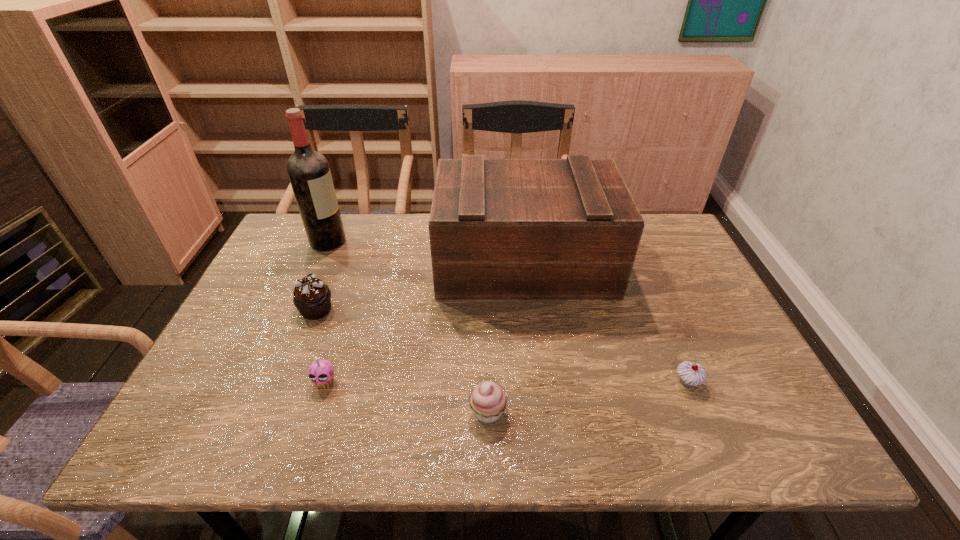
This screenshot has height=540, width=960. In order to click on vacant space located 0.270m on the left of the second cupcake from right to left in this screenshot , I will do `click(339, 412)`.

Find the location of a particular element. Image resolution: width=960 pixels, height=540 pixels. blank area located on the face of the third object from left to right is located at coordinates (308, 435).

At what (x,y) coordinates should I click in order to perform the action: click on liquor that is at the far edge. Please return your answer as a coordinate pair (x, y). Looking at the image, I should click on (308, 170).

I want to click on box at the far edge, so coord(500,229).

Where is `object that is at the near edge`? The image size is (960, 540). object that is at the near edge is located at coordinates (488, 401).

Find the location of a particular element. liquor at the left edge is located at coordinates (308, 170).

You are a GUI agent. You are given a task and a screenshot of the screen. Output one action in this format:
    pyautogui.click(x=<x>, y=<y>)
    Task: Click on the cupcake located in the left edge section of the desktop
    
    Given the screenshot: What is the action you would take?
    pyautogui.click(x=312, y=298)

Where is `object at the right edge`? The image size is (960, 540). object at the right edge is located at coordinates (691, 374).

Locate an element on the screen. The width and height of the screenshot is (960, 540). object that is positioned at the far left corner is located at coordinates (308, 170).

Find the location of `vacant space at the far edge of the desktop`. vacant space at the far edge of the desktop is located at coordinates (424, 219).